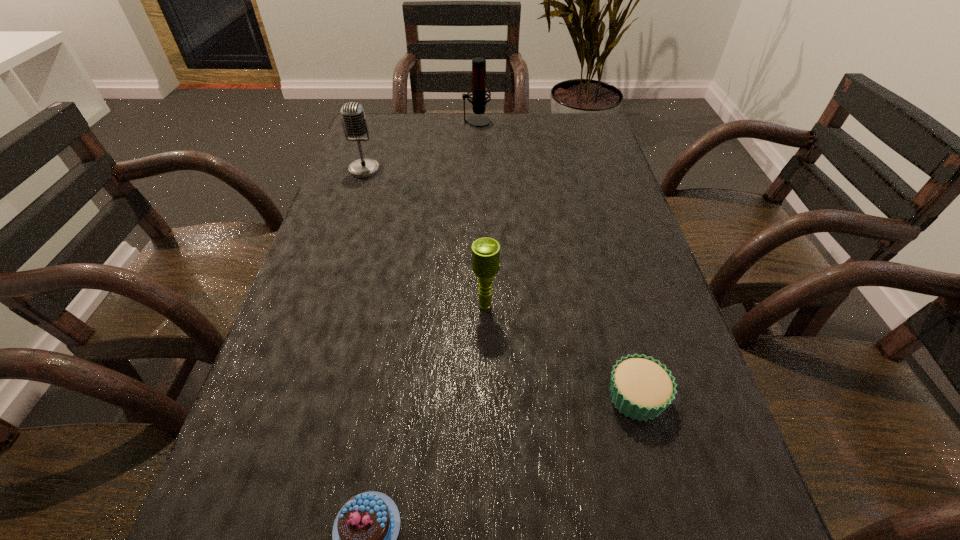
Find the location of a particular element. The height and width of the screenshot is (540, 960). unoccupied area between the nearest microphone and the rightmost object is located at coordinates (561, 351).

Where is `free spot between the cupcake and the leftmost object`? free spot between the cupcake and the leftmost object is located at coordinates (500, 283).

Where is `free space between the farthest microphone and the nearest microphone`? Image resolution: width=960 pixels, height=540 pixels. free space between the farthest microphone and the nearest microphone is located at coordinates (481, 214).

Find the location of a particular element. empty space that is in between the farthest object and the nearest microphone is located at coordinates (481, 214).

This screenshot has width=960, height=540. I want to click on the second closest object relative to the farthest microphone, so click(x=485, y=251).

The height and width of the screenshot is (540, 960). Identify the location of object that ranks as the fourth closest to the chocolate cake. (479, 91).

The height and width of the screenshot is (540, 960). I want to click on microphone identified as the second closest to the farthest object, so click(485, 251).

I want to click on microphone that is the closest to the farthest microphone, so click(x=354, y=122).